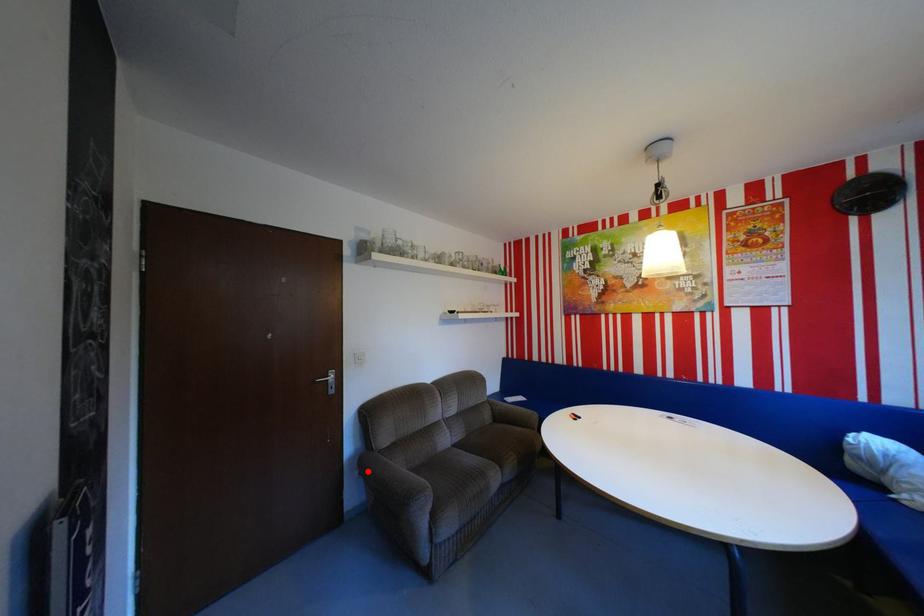
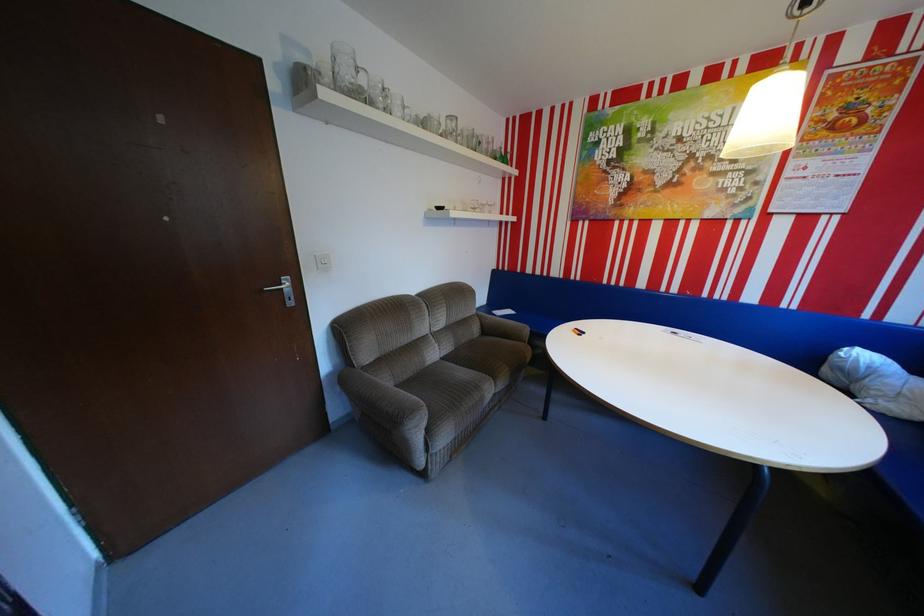
In the second image, find the point that corresponds to the highlighted location in the first image.

(349, 386)